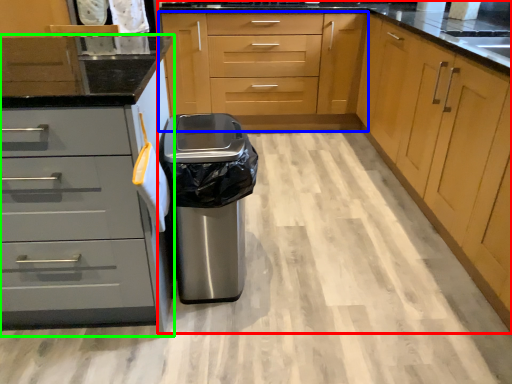
Question: Estimate the real-world distances between objects in this image. Which object is closer to cabinetry (highlighted by a red box), cabinetry (highlighted by a blue box) or cabinetry (highlighted by a green box)?

Choices:
 (A) cabinetry
 (B) cabinetry

Answer: (A)